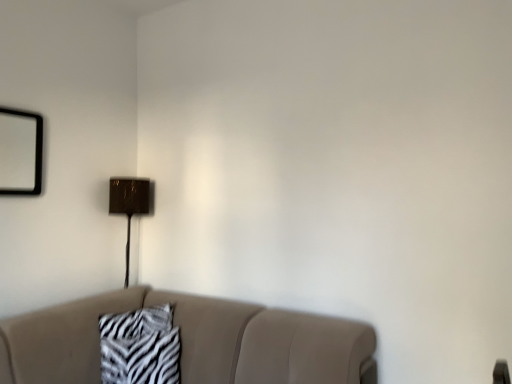
Question: Is metallic gold table lamp at upper center wider than beige fabric couch at lower center?

Choices:
 (A) yes
 (B) no

Answer: (B)

Question: From the image's perspective, is metallic gold table lamp at upper center below beige fabric couch at lower center?

Choices:
 (A) yes
 (B) no

Answer: (B)

Question: Does metallic gold table lamp at upper center have a greater height compared to beige fabric couch at lower center?

Choices:
 (A) no
 (B) yes

Answer: (B)

Question: Could you tell me if metallic gold table lamp at upper center is facing beige fabric couch at lower center?

Choices:
 (A) no
 (B) yes

Answer: (A)

Question: Does metallic gold table lamp at upper center appear on the left side of beige fabric couch at lower center?

Choices:
 (A) no
 (B) yes

Answer: (B)

Question: Is metallic gold table lamp at upper center to the right of beige fabric couch at lower center from the viewer's perspective?

Choices:
 (A) no
 (B) yes

Answer: (A)

Question: Is zebra-patterned fabric at center thinner than beige fabric couch at lower center?

Choices:
 (A) no
 (B) yes

Answer: (B)

Question: Is zebra-patterned fabric at center positioned beyond the bounds of beige fabric couch at lower center?

Choices:
 (A) yes
 (B) no

Answer: (B)

Question: From a real-world perspective, is zebra-patterned fabric at center over beige fabric couch at lower center?

Choices:
 (A) yes
 (B) no

Answer: (A)

Question: Can you confirm if zebra-patterned fabric at center is smaller than beige fabric couch at lower center?

Choices:
 (A) yes
 (B) no

Answer: (A)

Question: Does zebra-patterned fabric at center appear on the left side of beige fabric couch at lower center?

Choices:
 (A) yes
 (B) no

Answer: (A)

Question: From a real-world perspective, is zebra-patterned fabric at center physically below beige fabric couch at lower center?

Choices:
 (A) yes
 (B) no

Answer: (B)

Question: Does zebra-patterned fabric at center have a lesser width compared to metallic gold table lamp at upper center?

Choices:
 (A) yes
 (B) no

Answer: (A)